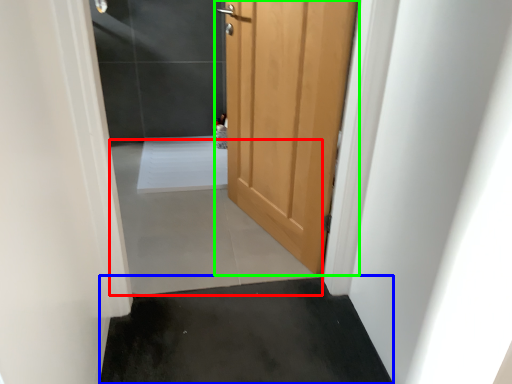
Question: Which object is the farthest from concrete (highlighted by a red box)? Choose among these: concrete (highlighted by a blue box) or door (highlighted by a green box).

Choices:
 (A) concrete
 (B) door

Answer: (B)